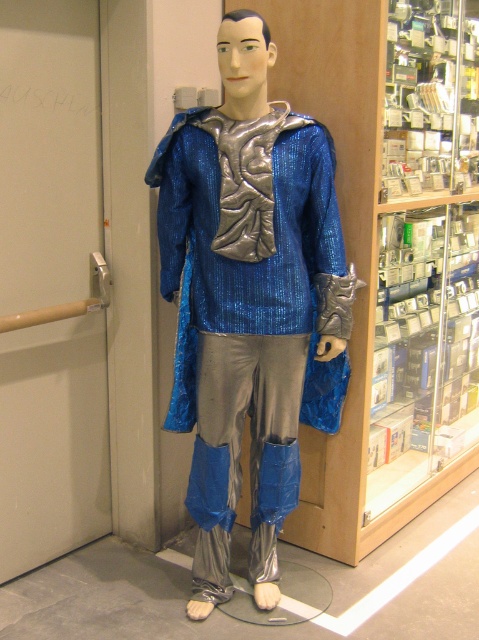
Is shiny metallic suit at center positioned before clear glass display case at center right?

Yes, shiny metallic suit at center is in front of clear glass display case at center right.

Measure the distance between shiny metallic suit at center and clear glass display case at center right.

shiny metallic suit at center and clear glass display case at center right are 28.09 inches apart from each other.

Who is more forward, (218, 307) or (467, 323)?

Point (218, 307) is more forward.

Where is `shiny metallic suit at center`? shiny metallic suit at center is located at coordinates (250, 301).